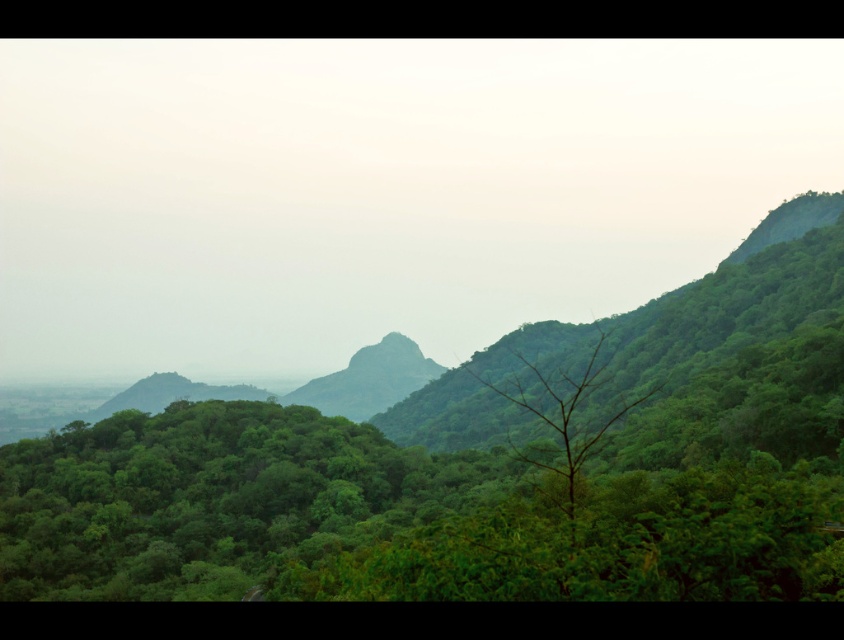
Question: Observing the image, what is the correct spatial positioning of green leafy tree at center in reference to green rock at center?

Choices:
 (A) right
 (B) left

Answer: (A)

Question: Does green leafy tree at center lie behind green rock at center?

Choices:
 (A) no
 (B) yes

Answer: (A)

Question: Which of the following is the farthest from the observer?

Choices:
 (A) green leafy tree at center
 (B) green rock at center

Answer: (B)

Question: Does green leafy tree at center appear over green rock at center?

Choices:
 (A) no
 (B) yes

Answer: (A)